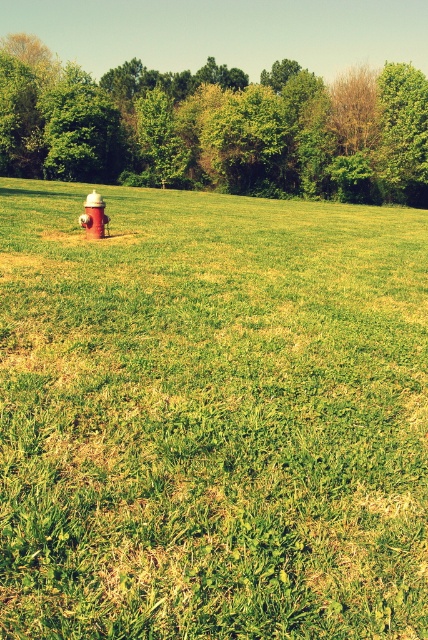
You are standing in the middle of the green grassy field at center and want to look up at the green leafy tree at upper center. In which direction should you look?

You should look upward because the green grassy field at center is located below the green leafy tree at upper center.

Consider the image. You are standing in the grassy field and want to take a photo of the red painted hydrant at center. To avoid including the green leafy tree at upper center in your photo, should you move to the left or the right of the hydrant?

You should move to the right of the red painted hydrant at center. Since the green leafy tree at upper center is to the left of the hydrant, moving right would position you away from the tree, keeping it out of the frame.